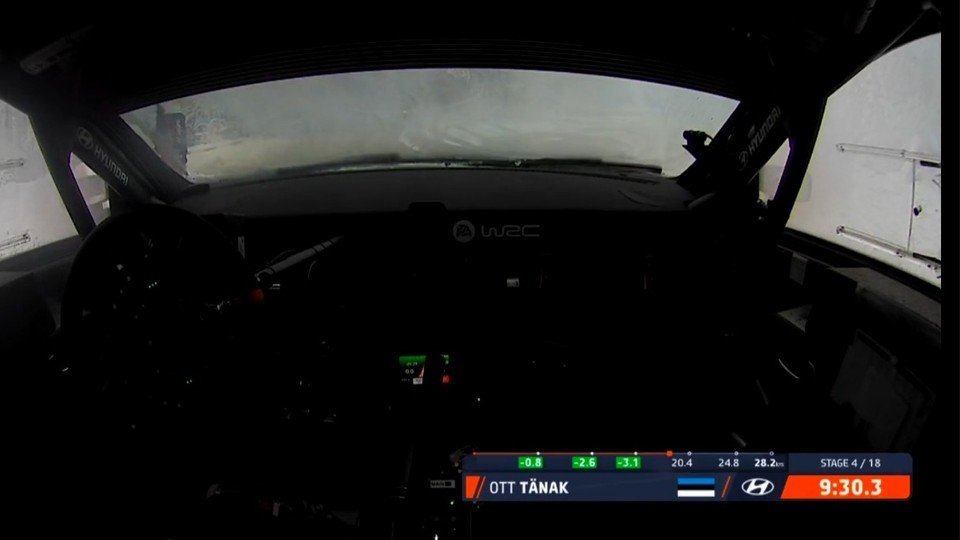
Find the location of a particular element. Image resolution: width=960 pixels, height=540 pixels. papers is located at coordinates (882, 404).